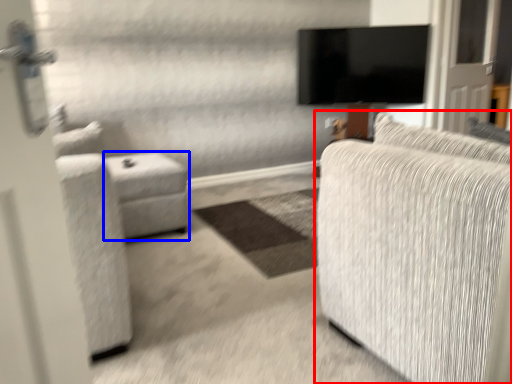
Question: Which object is further to the camera taking this photo, studio couch (highlighted by a red box) or table (highlighted by a blue box)?

Choices:
 (A) studio couch
 (B) table

Answer: (B)